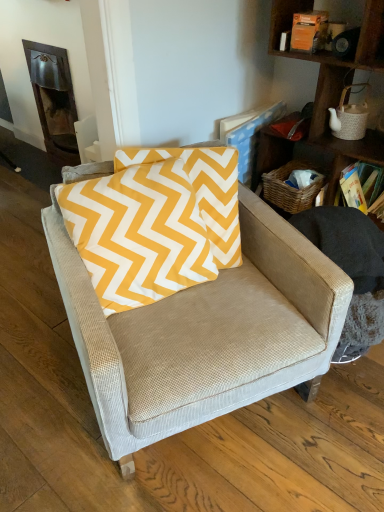
What are the coordinates of `hardcover book at upper right` in the screenshot? It's located at (359, 186).

Describe the element at coordinates (155, 223) in the screenshot. I see `yellow cotton pillow at center` at that location.

At what (x,y) coordinates should I click in order to perform the action: click on dark wood fireplace at upper left. Please return your answer as a coordinate pair (x, y). Looking at the image, I should click on (54, 99).

Image resolution: width=384 pixels, height=512 pixels. What do you see at coordinates (203, 333) in the screenshot? I see `beige fabric chair at center` at bounding box center [203, 333].

At what (x,y) coordinates should I click in order to perform the action: click on hardcover book at upper right. Please return your answer as a coordinate pair (x, y). Looking at the image, I should click on (359, 186).

Is hardcover book at upper right positioned far away from yellow cotton pillow at center?

Result: That's not correct — hardcover book at upper right is a little close to yellow cotton pillow at center.

Is hardcover book at upper right to the right of yellow cotton pillow at center from the viewer's perspective?

Correct, you'll find hardcover book at upper right to the right of yellow cotton pillow at center.

The width and height of the screenshot is (384, 512). I want to click on book that appears above the yellow cotton pillow at center (from the image's perspective), so click(359, 186).

Considering the relative sizes of hardcover book at upper right and yellow cotton pillow at center in the image provided, is hardcover book at upper right shorter than yellow cotton pillow at center?

Indeed, hardcover book at upper right has a lesser height compared to yellow cotton pillow at center.

Is dark wood fireplace at upper left behind hardcover book at upper right?

Yes, the depth of dark wood fireplace at upper left is greater than that of hardcover book at upper right.

Is hardcover book at upper right at the back of dark wood fireplace at upper left?

No, hardcover book at upper right is not at the back of dark wood fireplace at upper left.

In the scene shown: Is dark wood fireplace at upper left wider or thinner than hardcover book at upper right?

dark wood fireplace at upper left is thinner than hardcover book at upper right.

Does dark wood fireplace at upper left touch hardcover book at upper right?

No, dark wood fireplace at upper left is not making contact with hardcover book at upper right.

Is yellow cotton pillow at center taller or shorter than beige fabric chair at center?

In the image, yellow cotton pillow at center appears to be shorter than beige fabric chair at center.

Who is smaller, yellow cotton pillow at center or beige fabric chair at center?

yellow cotton pillow at center.

I want to click on pillow on the left of beige fabric chair at center, so click(x=155, y=223).

Considering the sizes of objects beige fabric chair at center and hardcover book at upper right in the image provided, who is bigger, beige fabric chair at center or hardcover book at upper right?

beige fabric chair at center.

Which point is more distant from viewer, (100, 314) or (340, 186)?

Positioned behind is point (340, 186).

Is beige fabric chair at center to the left of hardcover book at upper right from the viewer's perspective?

Yes, beige fabric chair at center is to the left of hardcover book at upper right.

Relative to yellow cotton pillow at center, is woven wood shelf at upper right in front or behind?

Visually, woven wood shelf at upper right is located behind yellow cotton pillow at center.

Is woven wood shelf at upper right facing towards yellow cotton pillow at center?

Yes, woven wood shelf at upper right is turned towards yellow cotton pillow at center.

From a real-world perspective, which object rests below the other?

From a 3D spatial view, yellow cotton pillow at center is below.

You are a GUI agent. You are given a task and a screenshot of the screen. Output one action in this format:
    pyautogui.click(x=<x>, y=<y>)
    Task: Click on the shelf on the right of beige fabric chair at center
    Image resolution: width=384 pixels, height=512 pixels.
    Given the screenshot: What is the action you would take?
    pyautogui.click(x=335, y=82)

How many degrees apart are the facing directions of beige fabric chair at center and woven wood shelf at upper right?

There is a 62.8-degree angle between the facing directions of beige fabric chair at center and woven wood shelf at upper right.

Can we say beige fabric chair at center lies outside woven wood shelf at upper right?

Yes, beige fabric chair at center is located beyond the bounds of woven wood shelf at upper right.

In the scene shown: From the image's perspective, does beige fabric chair at center appear higher than woven wood shelf at upper right?

Actually, beige fabric chair at center appears below woven wood shelf at upper right in the image.

Measure the distance from hardcover book at upper right to woven wood shelf at upper right.

hardcover book at upper right and woven wood shelf at upper right are 8.17 inches apart from each other.

Is hardcover book at upper right surrounding woven wood shelf at upper right?

No.

Considering the relative sizes of hardcover book at upper right and woven wood shelf at upper right in the image provided, is hardcover book at upper right wider than woven wood shelf at upper right?

No.

Who is taller, hardcover book at upper right or woven wood shelf at upper right?

With more height is woven wood shelf at upper right.

Where is `book that appears below the yellow cotton pillow at center (from a real-world perspective)`? The width and height of the screenshot is (384, 512). book that appears below the yellow cotton pillow at center (from a real-world perspective) is located at coordinates (359, 186).

The image size is (384, 512). In order to click on book on the right side of dark wood fireplace at upper left in this screenshot , I will do `click(359, 186)`.

From the image, which object appears to be nearer to dark wood fireplace at upper left, woven wood shelf at upper right or beige fabric chair at center?

woven wood shelf at upper right is positioned closer to the anchor dark wood fireplace at upper left.

From the image, which object appears to be farther from woven wood shelf at upper right, beige fabric chair at center or yellow cotton pillow at center?

Among the two, beige fabric chair at center is located further to woven wood shelf at upper right.

From the image, which object appears to be nearer to woven wood shelf at upper right, dark wood fireplace at upper left or beige fabric chair at center?

beige fabric chair at center is closer to woven wood shelf at upper right.

Based on their spatial positions, is hardcover book at upper right or beige fabric chair at center closer to dark wood fireplace at upper left?

Based on the image, beige fabric chair at center appears to be nearer to dark wood fireplace at upper left.

When comparing their distances from hardcover book at upper right, does woven wood shelf at upper right or yellow cotton pillow at center seem further?

Among the two, yellow cotton pillow at center is located further to hardcover book at upper right.

From the picture: From the image, which object appears to be nearer to dark wood fireplace at upper left, beige fabric chair at center or yellow cotton pillow at center?

yellow cotton pillow at center.

Looking at the image, which one is located closer to woven wood shelf at upper right, dark wood fireplace at upper left or hardcover book at upper right?

The object closer to woven wood shelf at upper right is hardcover book at upper right.

Estimate the real-world distances between objects in this image. Which object is further from hardcover book at upper right, dark wood fireplace at upper left or yellow cotton pillow at center?

Based on the image, dark wood fireplace at upper left appears to be further to hardcover book at upper right.

Image resolution: width=384 pixels, height=512 pixels. Identify the location of shelf between dark wood fireplace at upper left and hardcover book at upper right from left to right. (335, 82).

This screenshot has height=512, width=384. I want to click on chair between yellow cotton pillow at center and woven wood shelf at upper right from left to right, so click(203, 333).

Where is `shelf located between yellow cotton pillow at center and dark wood fireplace at upper left in the depth direction`? The image size is (384, 512). shelf located between yellow cotton pillow at center and dark wood fireplace at upper left in the depth direction is located at coordinates (335, 82).

Find the location of a particular element. The height and width of the screenshot is (512, 384). shelf located between beige fabric chair at center and hardcover book at upper right in the left-right direction is located at coordinates (335, 82).